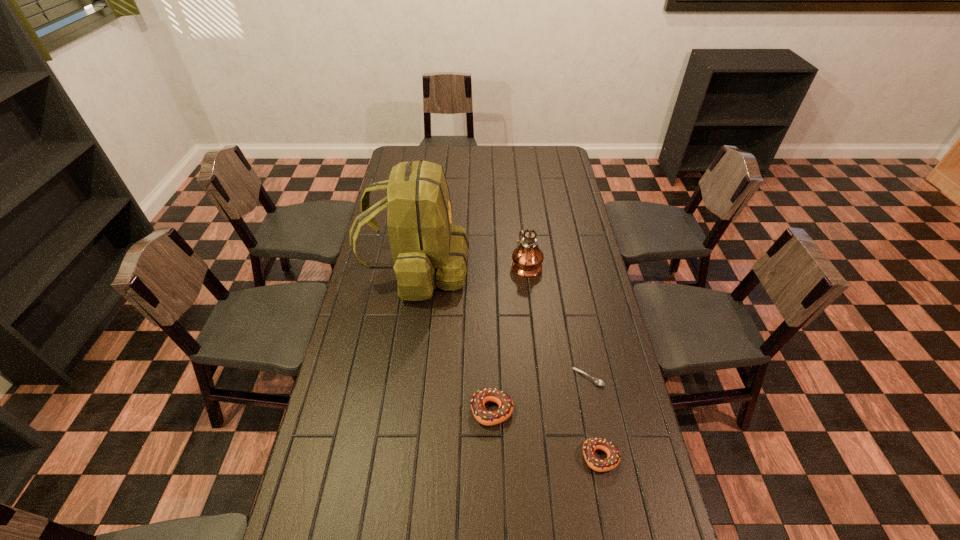
In order to click on free location at the left edge in this screenshot , I will do `click(364, 447)`.

The width and height of the screenshot is (960, 540). Identify the location of blank space at the right edge. (636, 447).

In the image, there is a desktop. Identify the location of vacant region at the far left corner. (396, 150).

Where is `free region at the far right corner of the desktop`? Image resolution: width=960 pixels, height=540 pixels. free region at the far right corner of the desktop is located at coordinates (559, 166).

At what (x,y) coordinates should I click in order to perform the action: click on free space between the backpack and the nearest object. Please return your answer as a coordinate pair (x, y). The height and width of the screenshot is (540, 960). Looking at the image, I should click on (509, 362).

At what (x,y) coordinates should I click in order to perform the action: click on vacant area that lies between the third shortest object and the third object from right to left. Please return your answer as a coordinate pair (x, y). The height and width of the screenshot is (540, 960). Looking at the image, I should click on (509, 337).

Find the location of a particular element. This screenshot has width=960, height=540. vacant space that is in between the shortest object and the nearest object is located at coordinates (594, 417).

I want to click on vacant space that's between the shortest object and the fourth shortest object, so click(557, 320).

This screenshot has width=960, height=540. I want to click on blank region between the second tallest object and the backpack, so pos(471,266).

You are a GUI agent. You are given a task and a screenshot of the screen. Output one action in this format:
    pyautogui.click(x=<x>, y=<y>)
    Task: Click on the empty space that is in between the left doughnut and the backpack
    
    Given the screenshot: What is the action you would take?
    pyautogui.click(x=454, y=339)